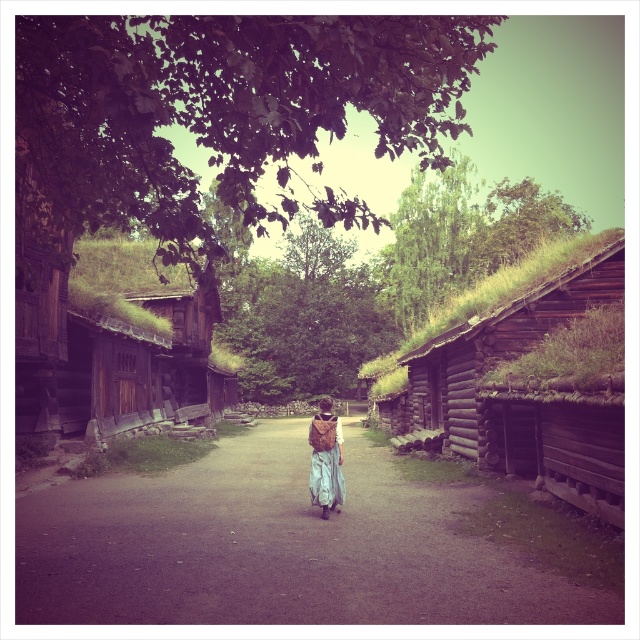
Which is behind, point (42, 163) or point (436, 426)?

The point (436, 426) is behind.

Can you confirm if green leafy tree at upper center is wider than green moss-covered log cabin at center-right?

Indeed, green leafy tree at upper center has a greater width compared to green moss-covered log cabin at center-right.

Between point (232, 44) and point (528, 465), which one is positioned behind?

The point (528, 465) is behind.

The image size is (640, 640). In order to click on green leafy tree at upper center in this screenshot , I will do `click(218, 109)`.

Is brown dirt path at center further to camera compared to green leafy tree at upper center?

Yes, it is behind green leafy tree at upper center.

Is brown dirt path at center to the left of green leafy tree at upper center from the viewer's perspective?

In fact, brown dirt path at center is to the right of green leafy tree at upper center.

Between point (465, 579) and point (349, 19), which one is positioned in front?

Point (349, 19) is more forward.

I want to click on brown dirt path at center, so click(291, 547).

Who is taller, brown dirt path at center or light brown fabric dress at center?

Standing taller between the two is light brown fabric dress at center.

Can you confirm if brown dirt path at center is positioned below light brown fabric dress at center?

Incorrect, brown dirt path at center is not positioned below light brown fabric dress at center.

Which is in front, point (490, 609) or point (321, 476)?

Point (490, 609) is more forward.

The image size is (640, 640). In order to click on brown dirt path at center in this screenshot , I will do `click(291, 547)`.